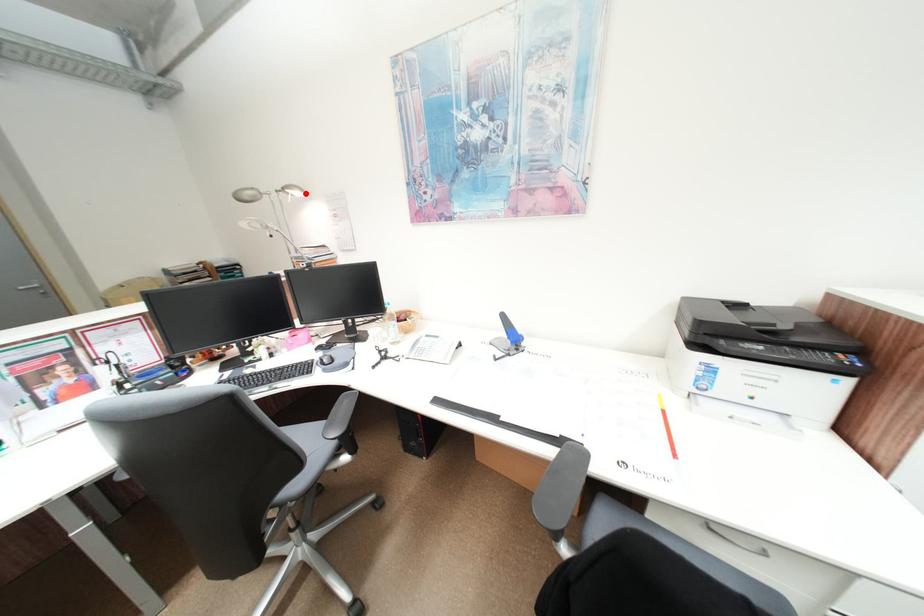
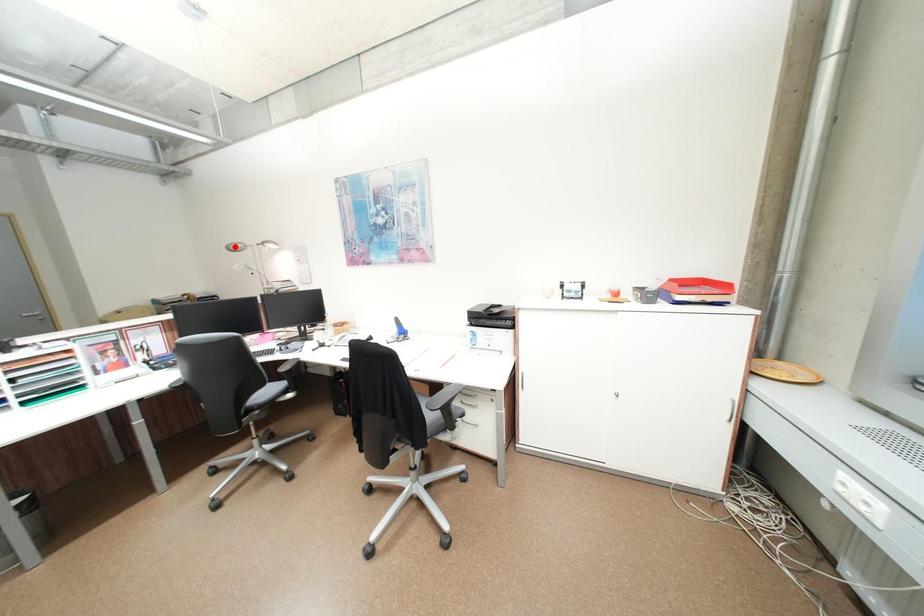
I am providing you with two images of the same scene from different viewpoints. A red point is marked on the first image and another point is marked on the second image. Does the point marked in image1 correspond to the same location as the one in image2?

No